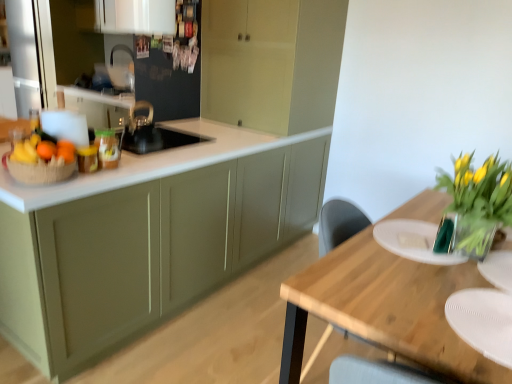
Identify the location of vacant area in front of white matte plate at right, which ranks as the first plate in top-to-bottom order. (420, 283).